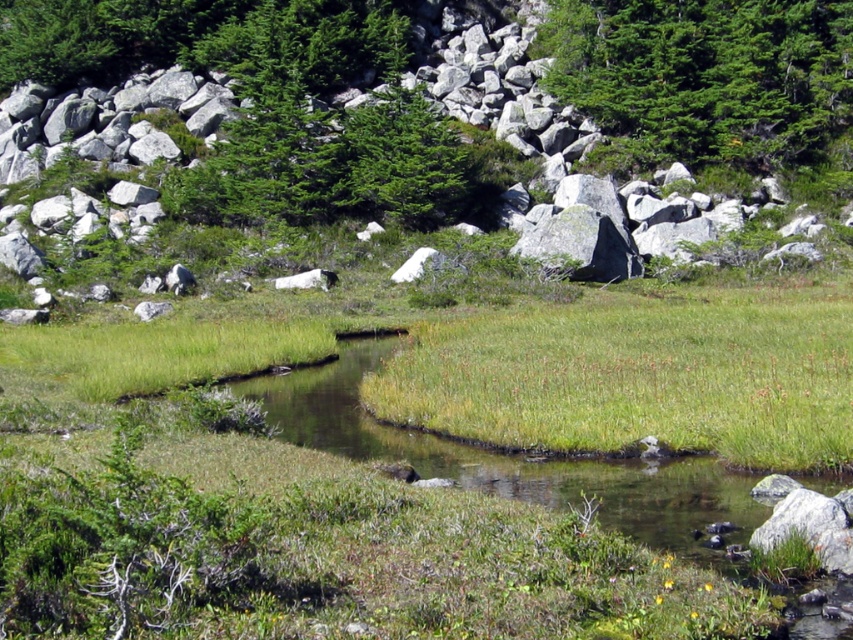
You are a hiker standing at the edge of the stream in the image. You want to find the tallest object between the green grassy at center and the green matte tree at upper center. Which one should you look up to see?

The green matte tree at upper center is taller than the green grassy at center, so you should look up to see the green matte tree at upper center.

Based on the photo, you are standing at the edge of the stream and see the green grassy at center and the green matte tree at upper center. Which object is positioned to the left of the other?

The green grassy at center is positioned to the left of the green matte tree at upper center.

You are standing at the point with coordinates point (743, 52) and want to walk to the point with coordinates point (833, 444). Which direction should you move relative to the other point?

You should move forward towards point (833, 444) since it is in front of point (743, 52).